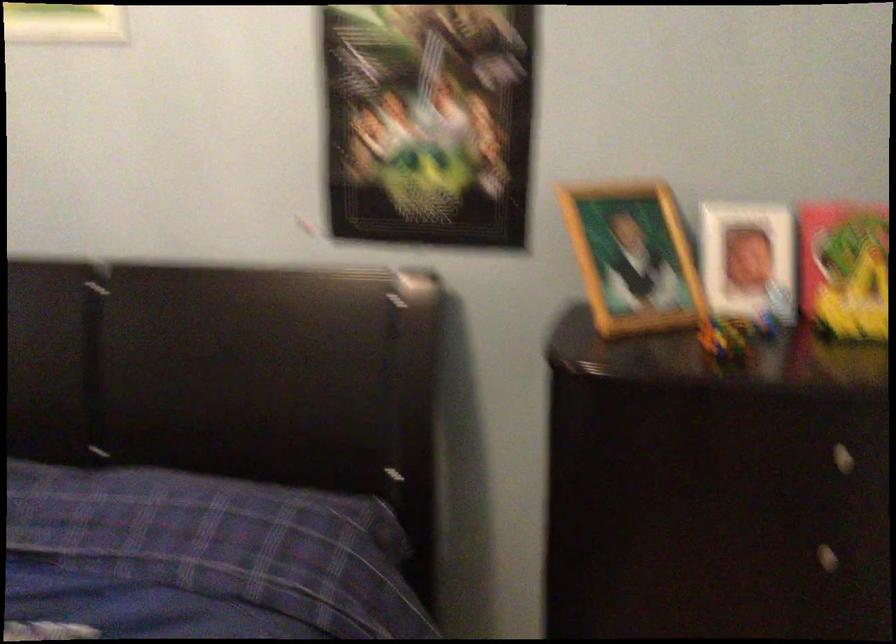
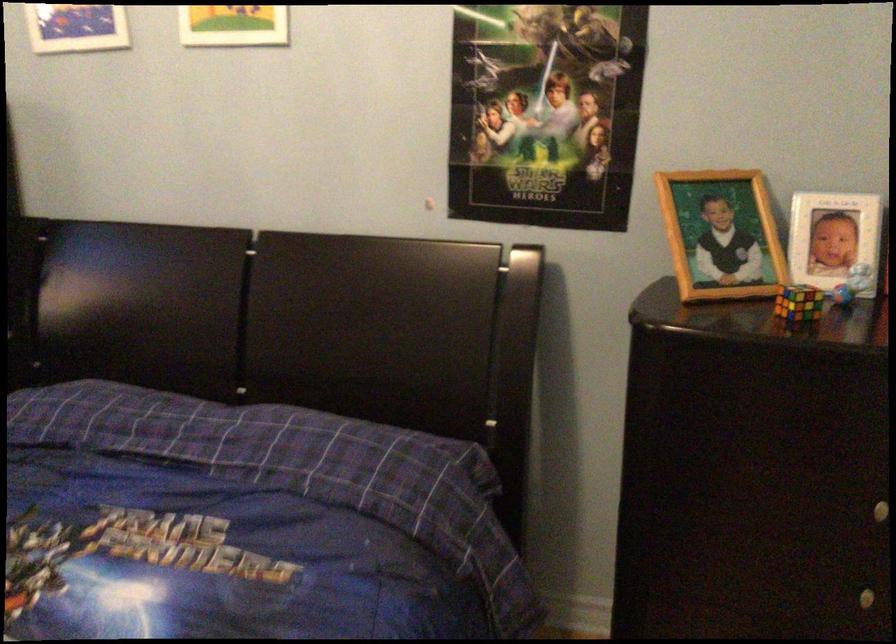
Find the pixel in the second image that matches [719,328] in the first image.

(798, 303)